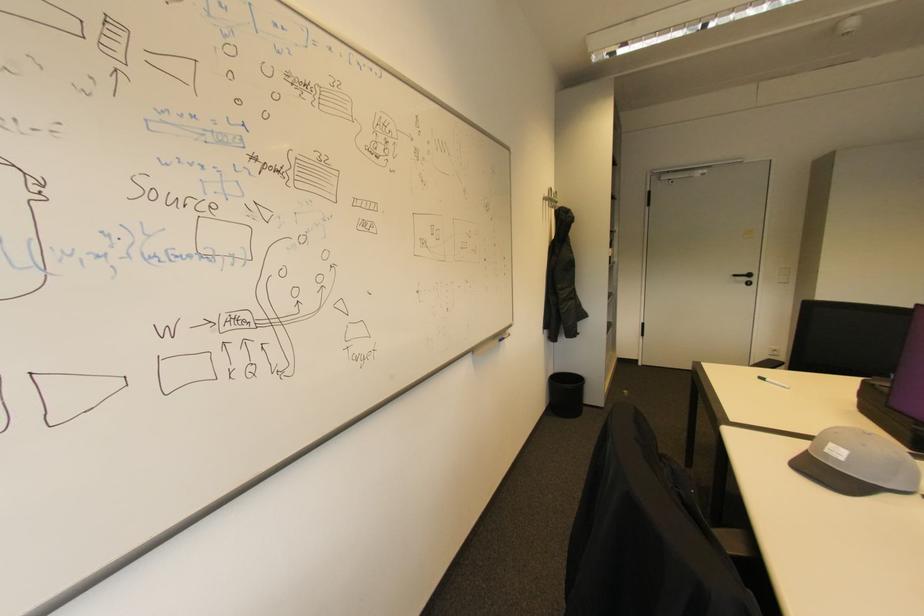
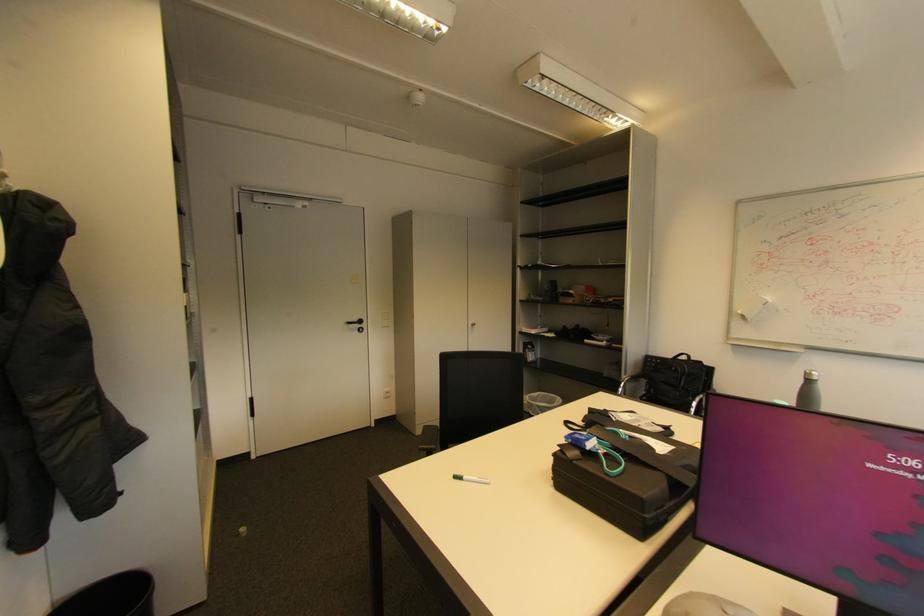
Locate, in the second image, the point that corresponds to (628,394) in the first image.

(244, 535)